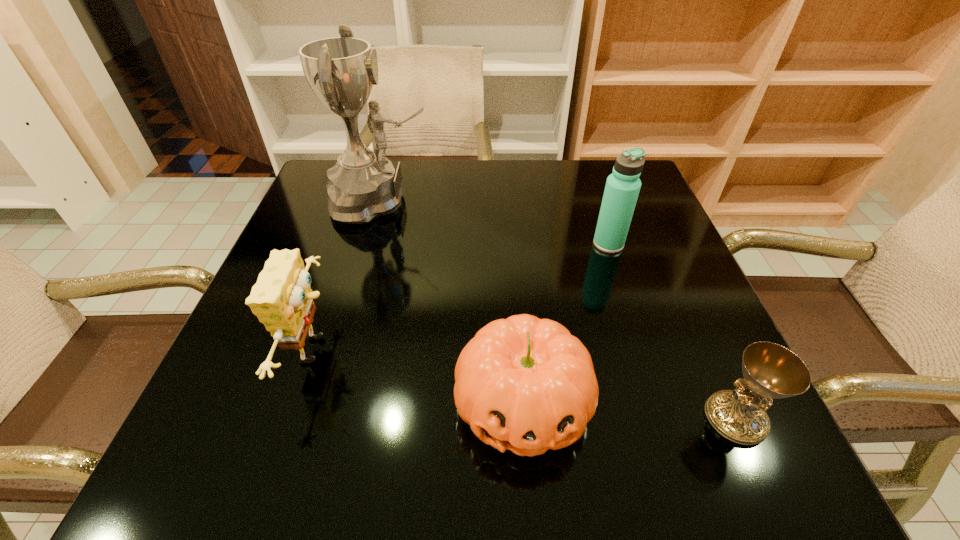
The image size is (960, 540). I want to click on the tallest object, so click(x=341, y=71).

Identify the location of the fourth shortest object. The height and width of the screenshot is (540, 960). (622, 188).

Where is `the fourth object from left to right`? the fourth object from left to right is located at coordinates [x=622, y=188].

Locate an element on the screen. Image resolution: width=960 pixels, height=540 pixels. the third shortest object is located at coordinates (282, 297).

Where is `the third object from right to left`? the third object from right to left is located at coordinates (526, 384).

Locate an element on the screen. chalice is located at coordinates (771, 371).

Image resolution: width=960 pixels, height=540 pixels. What are the coordinates of `free location located on the side with emblem of the tallest object` in the screenshot? It's located at (463, 201).

The height and width of the screenshot is (540, 960). In order to click on vacant region located 0.100m on the front of the fourth object from left to right in this screenshot , I will do `click(622, 286)`.

The image size is (960, 540). I want to click on vacant space situated on the face of the sponge, so click(x=531, y=349).

This screenshot has width=960, height=540. I want to click on vacant space situated 0.240m on the left of the chalice, so click(x=552, y=418).